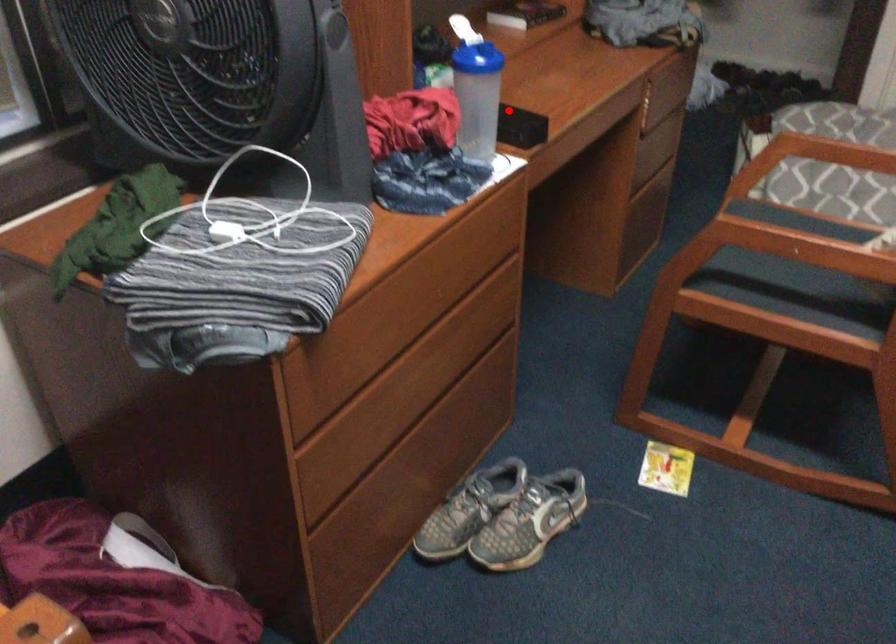
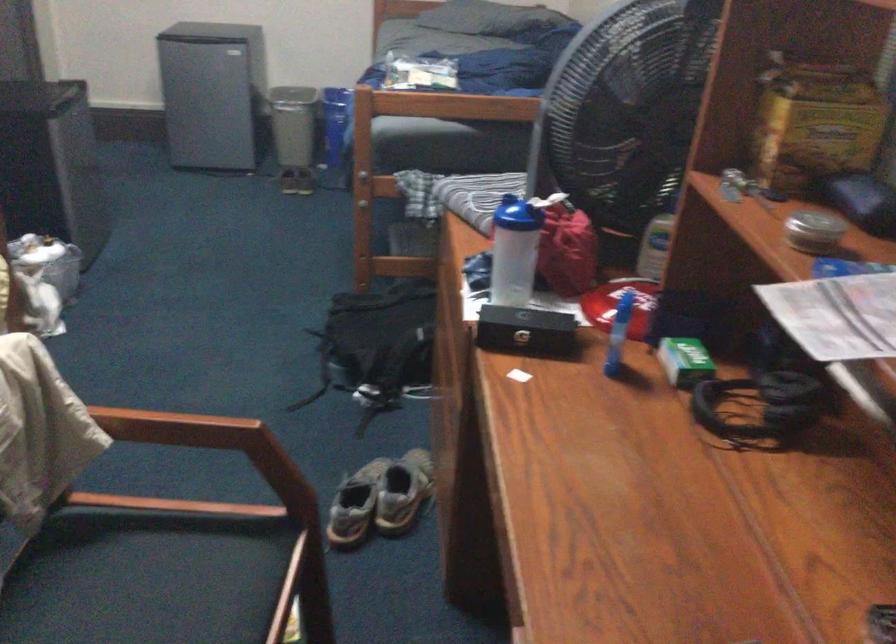
In the second image, find the point that corresponds to the highlighted location in the first image.

(526, 330)